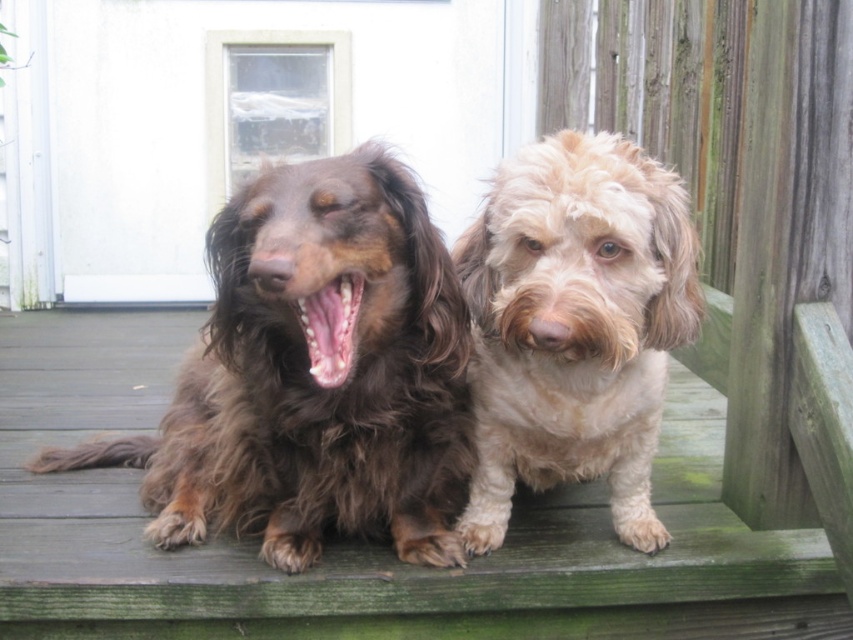
Question: Is brown shaggy dog at center to the left of white fluffy dog at center from the viewer's perspective?

Choices:
 (A) no
 (B) yes

Answer: (B)

Question: Considering the real-world distances, which object is farthest from the brown shaggy dog at center?

Choices:
 (A) white fluffy dog at center
 (B) bright pink glossy teeth at center

Answer: (B)

Question: Observing the image, what is the correct spatial positioning of brown shaggy dog at center in reference to white fluffy dog at center?

Choices:
 (A) left
 (B) right

Answer: (A)

Question: Which point appears closest to the camera in this image?

Choices:
 (A) (296, 416)
 (B) (86, 588)
 (C) (335, 364)
 (D) (635, 204)

Answer: (C)

Question: Which object is positioned farthest from the green wood deck at center?

Choices:
 (A) brown shaggy dog at center
 (B) white fluffy dog at center
 (C) bright pink glossy teeth at center

Answer: (C)

Question: Does brown shaggy dog at center appear on the left side of white fluffy dog at center?

Choices:
 (A) yes
 (B) no

Answer: (A)